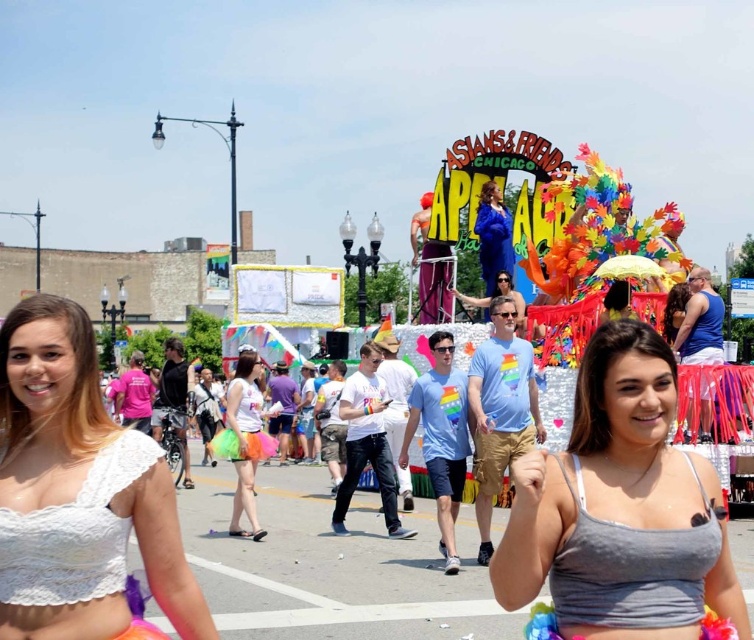
Does gray fabric top at center appear on the left side of white lace bikini top at lower left?

Result: Incorrect, gray fabric top at center is not on the left side of white lace bikini top at lower left.

Between point (581, 412) and point (60, 464), which one is positioned behind?

Point (581, 412)

Find the location of a particular element. The width and height of the screenshot is (754, 640). gray fabric top at center is located at coordinates (621, 508).

Does rainbow tulle skirt at center appear under matte blue dress at center?

Yes.

Identify the location of rainbow tulle skirt at center. The height and width of the screenshot is (640, 754). (247, 440).

Find the location of a particular element. rainbow tulle skirt at center is located at coordinates (247, 440).

Can you confirm if gray fabric top at center is wider than matte blue dress at center?

Yes.

Who is more distant from viewer, (636, 412) or (486, 256)?

Point (486, 256)

I want to click on gray fabric top at center, so click(621, 508).